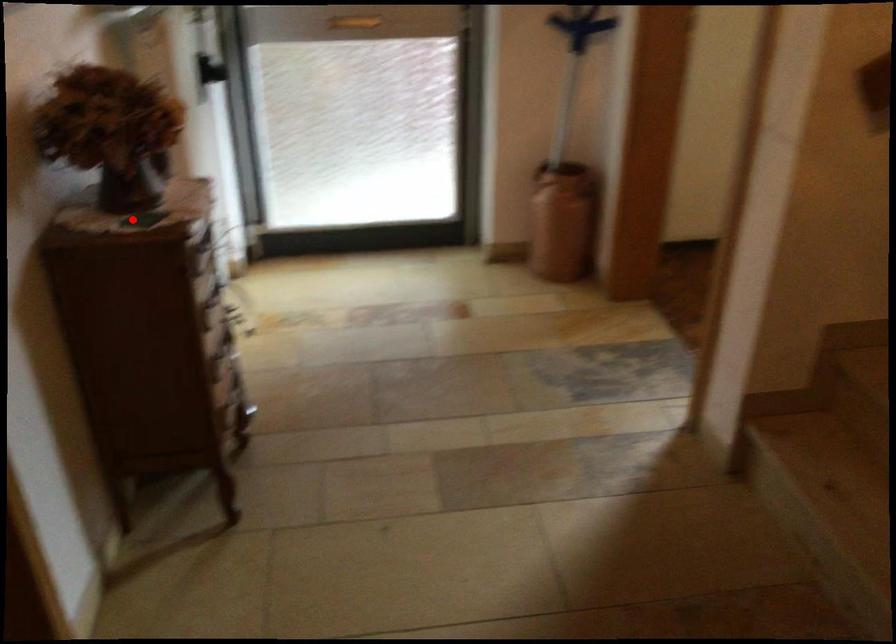
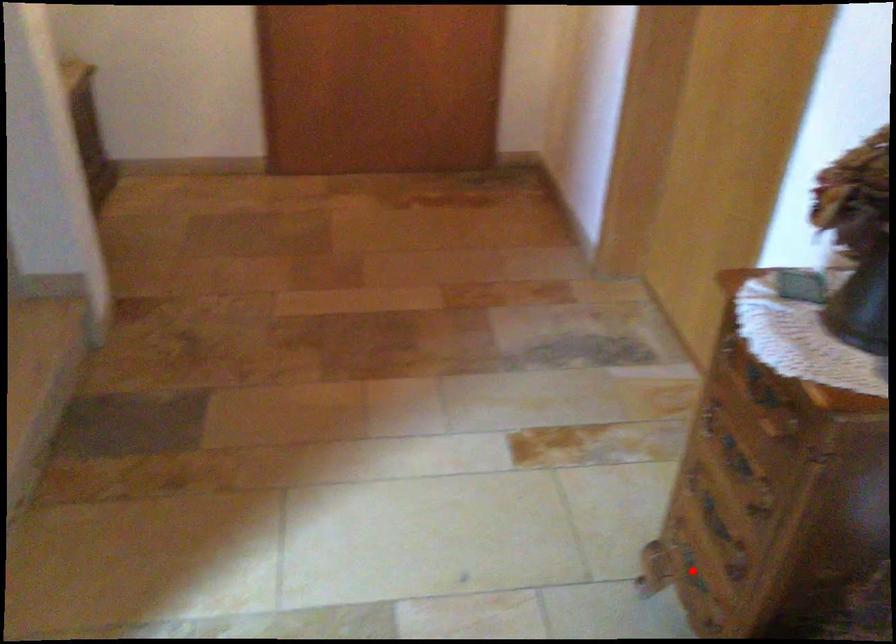
I am providing you with two images of the same scene from different viewpoints. A red point is marked on the first image and another point is marked on the second image. Are the points marked in image1 and image2 representing the same 3D position?

No